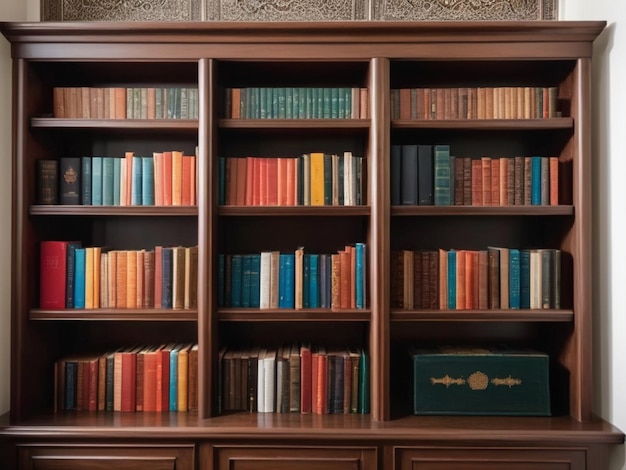
Identify the location of vertical pieces of wood separating the spots for books on the shelves. (16, 200), (205, 202), (380, 220), (583, 229).